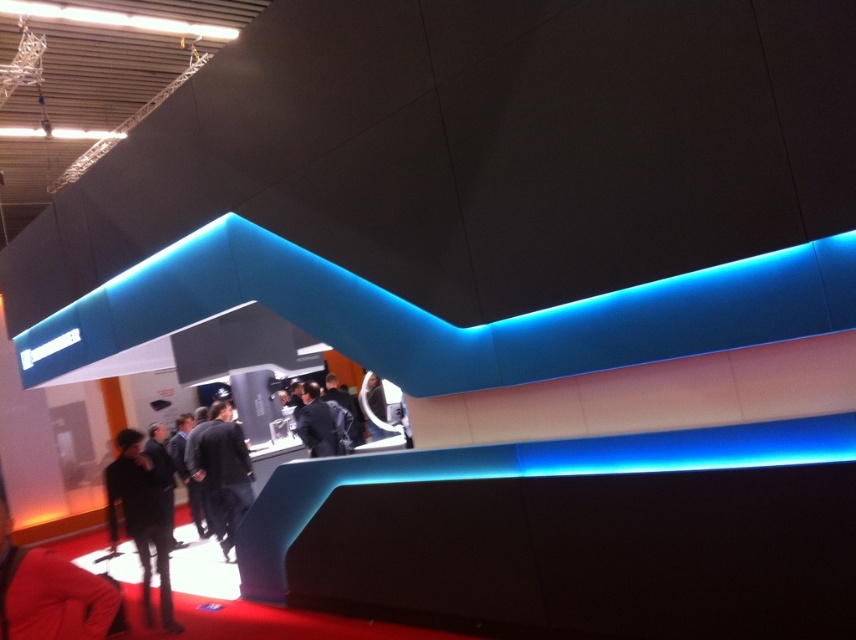
You are an event organizer at the exhibition hall and need to place a 1.8 meter tall stand between the black fabric coat at lower left and the black suit at center. Can you fit it there?

The black fabric coat at lower left is taller than the black suit at center. Since the stand is 1.8 meters tall, it may not fit if the available space between them is less than 1.8 meters. However, the description only provides information about their heights, not the distance between them. Without knowing the distance, it is impossible to determine if the stand will fit.

In the scene shown: You are a photographer at the exhibition hall and need to capture both the black fabric coat at lower left and the black fabric suit at center in a single frame. Which object should you focus on first to ensure both are in the frame?

The black fabric coat at lower left is smaller than the black fabric suit at center, so you should focus on the black fabric suit at center first to ensure both are in the frame.

From the picture: You are standing in the exhibition hall and want to determine which of the two points, point [223,460] or point [312,432], is nearer to you. Based on the scene description, which point is closer?

Point [223,460] is closer to the viewer than point [312,432].